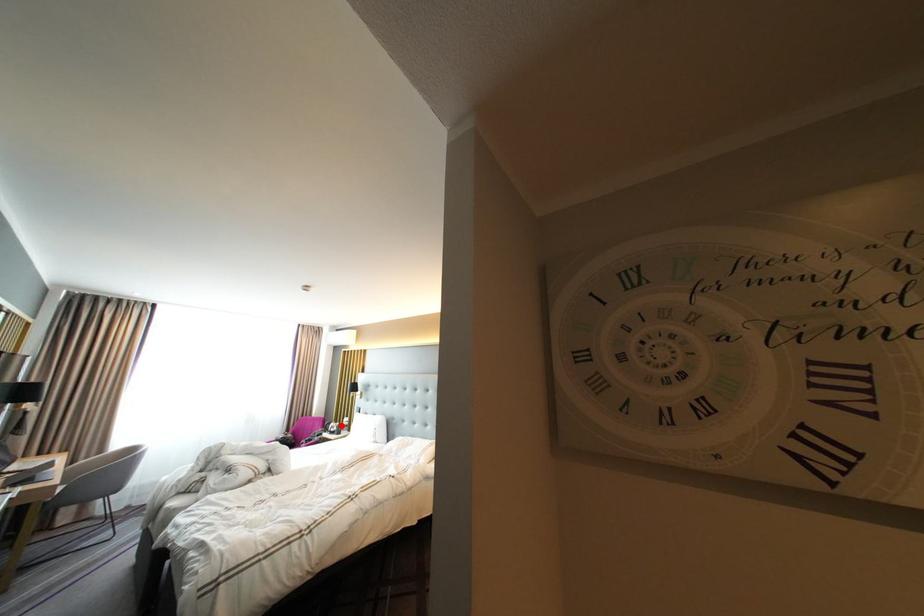
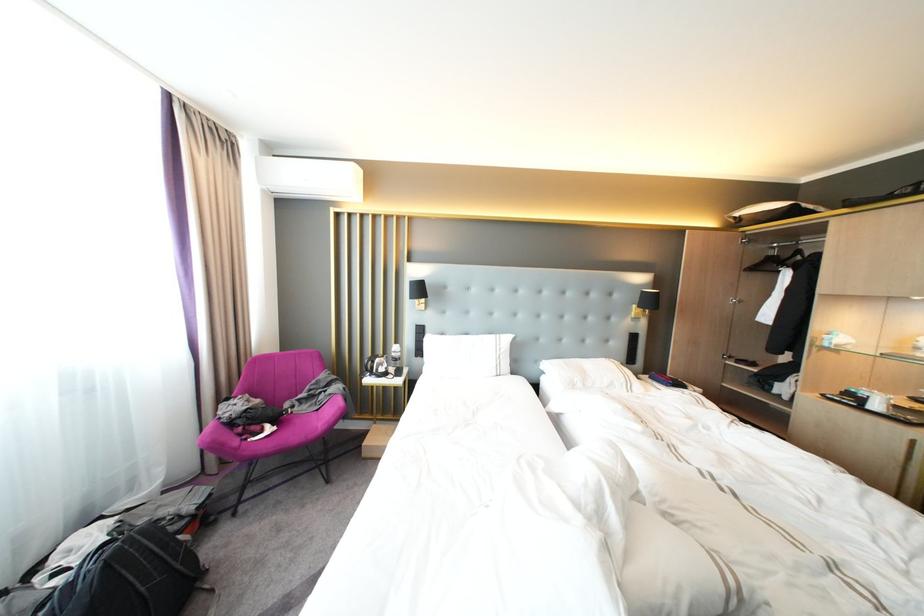
Locate, in the second image, the point that corresponds to the highlighted location in the first image.

(384, 363)